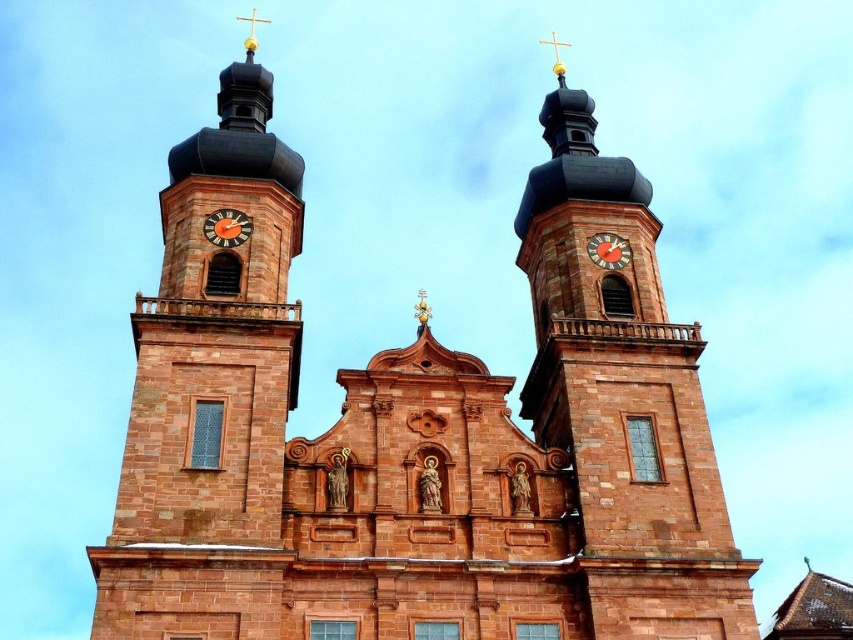
Between orange metallic clock at upper left and orange wooden clock at center, which one is positioned lower?

orange wooden clock at center is below.

Does orange metallic clock at upper left have a larger size compared to orange wooden clock at center?

Yes, orange metallic clock at upper left is bigger than orange wooden clock at center.

Locate an element on the screen. The width and height of the screenshot is (853, 640). orange metallic clock at upper left is located at coordinates (227, 227).

The image size is (853, 640). Find the location of `orange metallic clock at upper left`. orange metallic clock at upper left is located at coordinates (227, 227).

Which is more to the right, brown stone tower at center or orange metallic clock at upper left?

brown stone tower at center

Who is more forward, (611, 372) or (236, 218)?

Positioned in front is point (611, 372).

The height and width of the screenshot is (640, 853). In order to click on brown stone tower at center in this screenshot , I will do `click(624, 400)`.

Can you confirm if brown stone tower at left is smaller than orange wooden clock at center?

Actually, brown stone tower at left might be larger than orange wooden clock at center.

Is brown stone tower at left to the right of orange wooden clock at center from the viewer's perspective?

Incorrect, brown stone tower at left is not on the right side of orange wooden clock at center.

Measure the distance between point (148, 504) and camera.

Point (148, 504) is 39.09 meters from camera.

Where is `brown stone tower at left`? The image size is (853, 640). brown stone tower at left is located at coordinates (210, 392).